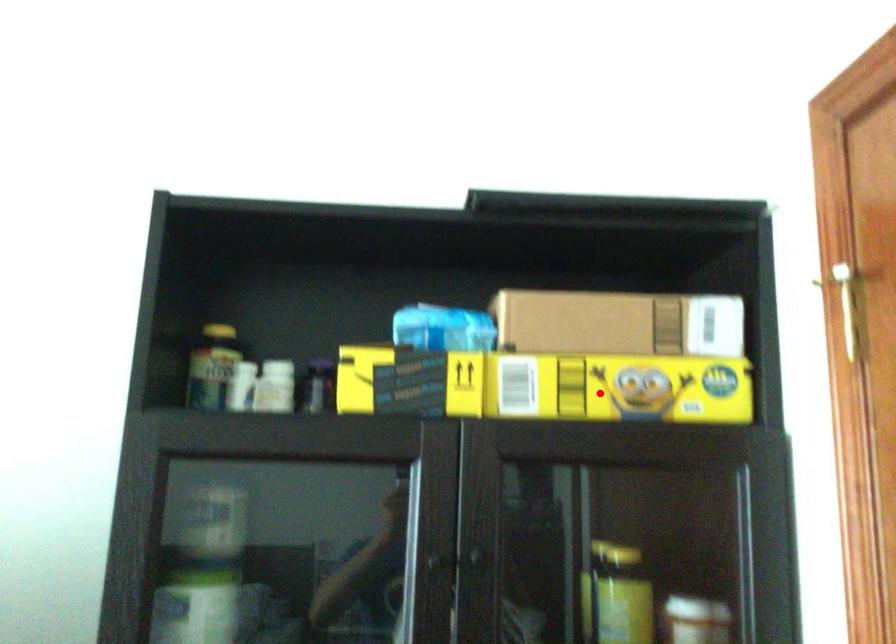
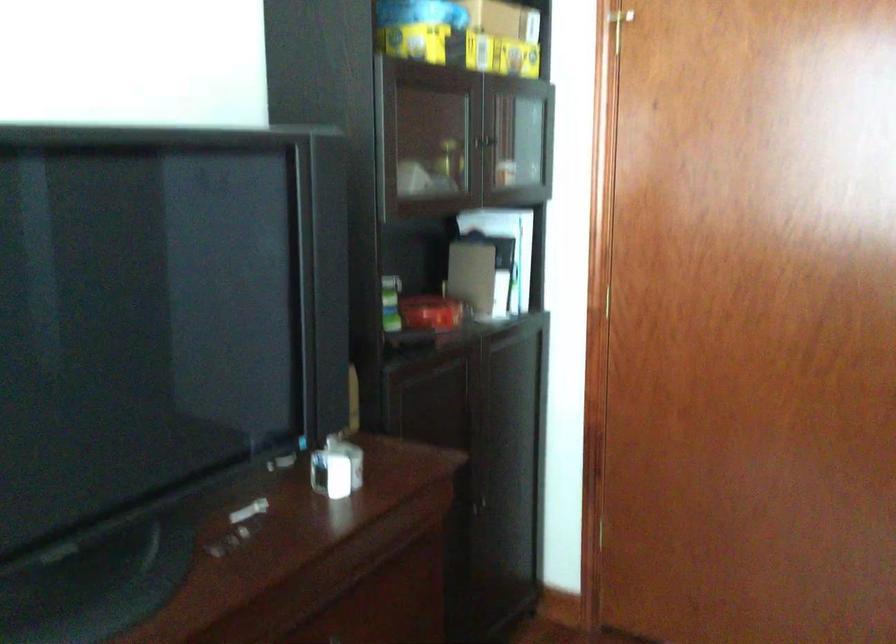
Question: I am providing you with two images of the same scene from different viewpoints. A red point is marked on the first image. At the location where the point appears in image 1, is it still visible in image 2?

Choices:
 (A) Yes
 (B) No

Answer: (A)